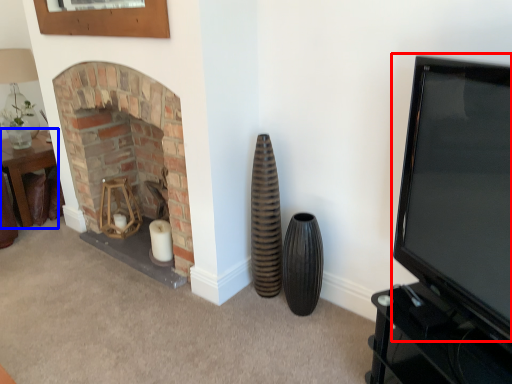
Question: Among these objects, which one is nearest to the camera, television (highlighted by a red box) or table (highlighted by a blue box)?

Choices:
 (A) television
 (B) table

Answer: (A)